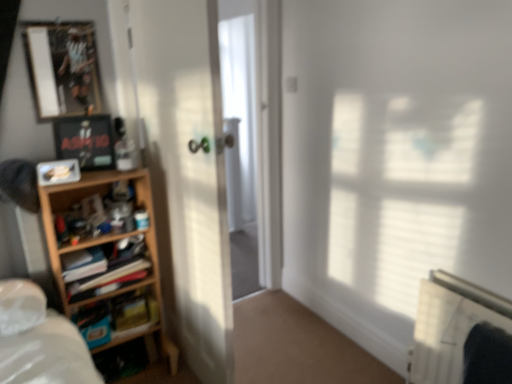
Question: Does hardcover book at left come in front of metallic silver picture frame at upper left, the first picture frame viewed from the top?

Choices:
 (A) yes
 (B) no

Answer: (B)

Question: From a real-world perspective, is hardcover book at left under metallic silver picture frame at upper left, the third picture frame positioned from the bottom?

Choices:
 (A) no
 (B) yes

Answer: (B)

Question: From the image's perspective, does hardcover book at left appear lower than metallic silver picture frame at upper left, the first picture frame viewed from the top?

Choices:
 (A) no
 (B) yes

Answer: (B)

Question: Does hardcover book at left contain metallic silver picture frame at upper left, the first picture frame viewed from the top?

Choices:
 (A) yes
 (B) no

Answer: (B)

Question: Considering the relative positions of hardcover book at left and metallic silver picture frame at upper left, the first picture frame viewed from the top, in the image provided, is hardcover book at left to the right of metallic silver picture frame at upper left, the first picture frame viewed from the top, from the viewer's perspective?

Choices:
 (A) no
 (B) yes

Answer: (B)

Question: Considering the relative positions of hardcover book at left and wooden shelf at left, which is counted as the 2th shelf, starting from the top, in the image provided, is hardcover book at left to the left or to the right of wooden shelf at left, which is counted as the 2th shelf, starting from the top,?

Choices:
 (A) left
 (B) right

Answer: (B)

Question: In terms of size, does hardcover book at left appear bigger or smaller than wooden shelf at left, marked as the first shelf in a bottom-to-top arrangement?

Choices:
 (A) big
 (B) small

Answer: (B)

Question: Is hardcover book at left in front of or behind wooden shelf at left, which is counted as the 2th shelf, starting from the top, in the image?

Choices:
 (A) behind
 (B) front

Answer: (A)

Question: Is hardcover book at left spatially inside wooden shelf at left, which is counted as the 2th shelf, starting from the top, or outside of it?

Choices:
 (A) inside
 (B) outside

Answer: (A)

Question: From a real-world perspective, is matte plastic picture frame at left, the 1th picture frame positioned from the bottom, positioned above or below hardcover book at left?

Choices:
 (A) above
 (B) below

Answer: (A)

Question: Considering the positions of point (48, 182) and point (141, 294), is point (48, 182) closer or farther from the camera than point (141, 294)?

Choices:
 (A) farther
 (B) closer

Answer: (B)

Question: In the image, is matte plastic picture frame at left, the 1th picture frame positioned from the bottom, on the left side or the right side of hardcover book at left?

Choices:
 (A) left
 (B) right

Answer: (A)

Question: Looking at their shapes, would you say matte plastic picture frame at left, the 1th picture frame positioned from the bottom, is wider or thinner than hardcover book at left?

Choices:
 (A) wide
 (B) thin

Answer: (B)

Question: From the image's perspective, is wooden shelf at left, which appears as the 2th shelf when ordered from the bottom, located above or below white plastic radiator at lower right?

Choices:
 (A) above
 (B) below

Answer: (A)

Question: From a real-world perspective, relative to white plastic radiator at lower right, is wooden shelf at left, which appears as the 2th shelf when ordered from the bottom, vertically above or below?

Choices:
 (A) above
 (B) below

Answer: (A)